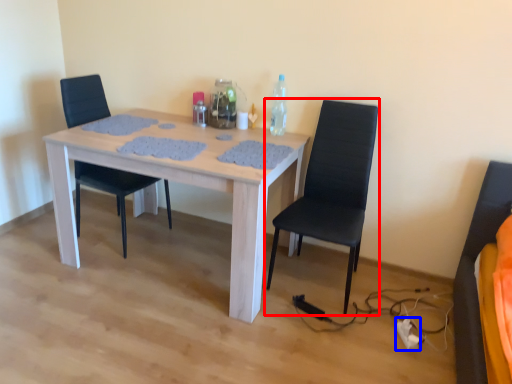
Question: Which of the following is the farthest to the observer, chair (highlighted by a red box) or extension cord (highlighted by a blue box)?

Choices:
 (A) chair
 (B) extension cord

Answer: (B)